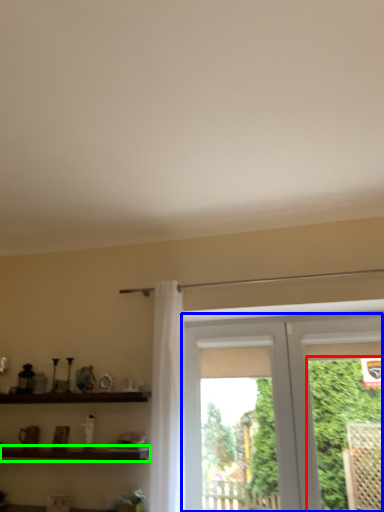
Question: Which object is positioned closest to plant (highlighted by a red box)? Select from window (highlighted by a blue box) and shelf (highlighted by a green box).

Choices:
 (A) window
 (B) shelf

Answer: (A)